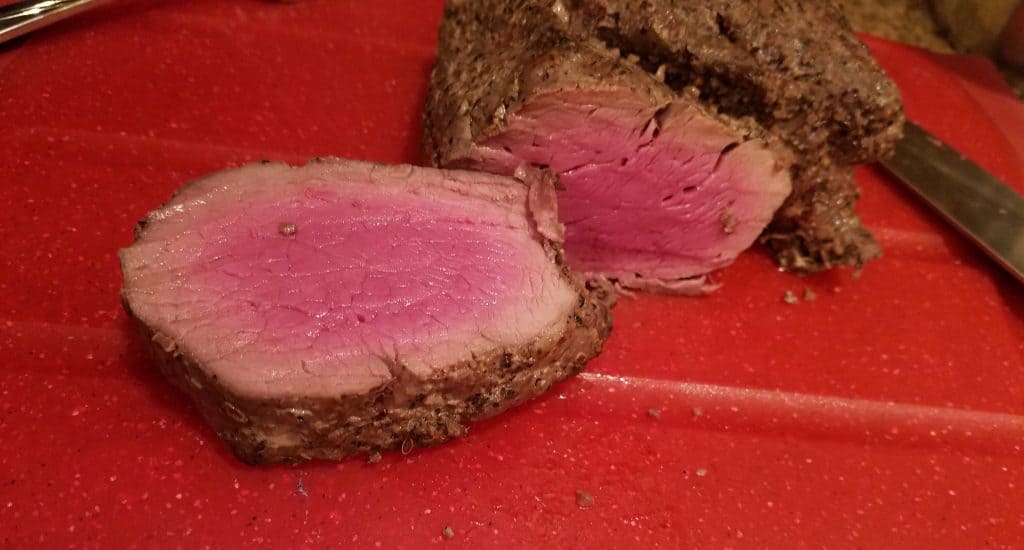
Image resolution: width=1024 pixels, height=550 pixels. I want to click on handle, so click(966, 210).